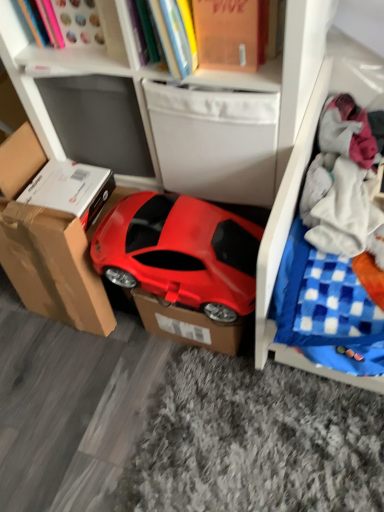
You are a GUI agent. You are given a task and a screenshot of the screen. Output one action in this format:
    pyautogui.click(x=<x>, y=<y>)
    Task: Click on the white matte drawer at center
    
    Given the screenshot: What is the action you would take?
    pyautogui.click(x=215, y=141)

What is the approximate width of brown cardboard box at left, arranged as the second cardboard box when viewed from the right?

It is 4.59 inches.

Identify the location of matte white bookcase at upper center. (171, 108).

Where is `orange matte book at upper center`? Image resolution: width=384 pixels, height=512 pixels. orange matte book at upper center is located at coordinates (222, 45).

At what (x,y) coordinates should I click in order to perform the action: click on white plastic cabinet at upper center. Please return your answer as a coordinate pair (x, y). The image size is (384, 512). Looking at the image, I should click on (51, 51).

From the image's perspective, which one is positioned lower, white soft fabric at right or matte cardboard box at center, the first cardboard box viewed from the right?

matte cardboard box at center, the first cardboard box viewed from the right, appears lower in the image.

Is white soft fabric at right far from matte cardboard box at center, the first cardboard box viewed from the right?

Actually, white soft fabric at right and matte cardboard box at center, the first cardboard box viewed from the right, are a little close together.

Which is more to the right, white soft fabric at right or matte cardboard box at center, the first cardboard box viewed from the right?

white soft fabric at right.

Between point (357, 135) and point (186, 311), which one is positioned in front?

Positioned in front is point (357, 135).

Looking at this image, is white matte drawer at center aimed at matte white bookcase at upper center?

Yes, white matte drawer at center is oriented towards matte white bookcase at upper center.

At what (x,y) coordinates should I click in order to perform the action: click on drawer above the matte white bookcase at upper center (from a real-world perspective). Please return your answer as a coordinate pair (x, y). This screenshot has height=512, width=384. Looking at the image, I should click on (215, 141).

From a real-world perspective, is white matte drawer at center positioned over matte white bookcase at upper center based on gravity?

Indeed, from a real-world perspective, white matte drawer at center stands above matte white bookcase at upper center.

Measure the distance between orange matte book at upper center and white soft fabric at right.

orange matte book at upper center and white soft fabric at right are 15.08 inches apart from each other.

Is orange matte book at upper center oriented away from white soft fabric at right?

No.

From the image's perspective, is orange matte book at upper center above or below white soft fabric at right?

Based on their image positions, orange matte book at upper center is located above white soft fabric at right.

From a real-world perspective, who is located lower, orange matte book at upper center or white soft fabric at right?

white soft fabric at right is physically lower.

Considering the sizes of objects white soft fabric at right and brown cardboard box at left, the first cardboard box positioned from the left, in the image provided, who is smaller, white soft fabric at right or brown cardboard box at left, the first cardboard box positioned from the left,?

white soft fabric at right is smaller.

Is white soft fabric at right facing towards brown cardboard box at left, the first cardboard box positioned from the left?

No, white soft fabric at right is not turned towards brown cardboard box at left, the first cardboard box positioned from the left.

From a real-world perspective, does white soft fabric at right sit lower than brown cardboard box at left, arranged as the second cardboard box when viewed from the right?

No, from a real-world perspective, white soft fabric at right is not below brown cardboard box at left, arranged as the second cardboard box when viewed from the right.

What are the coordinates of `clothing on the right side of brown cardboard box at left, the first cardboard box positioned from the left` in the screenshot? It's located at (345, 182).

Are white plastic cabinet at upper center and matte cardboard box at center, the first cardboard box viewed from the right, located far from each other?

No, white plastic cabinet at upper center is not far away from matte cardboard box at center, the first cardboard box viewed from the right.

From the image's perspective, does white plastic cabinet at upper center appear lower than matte cardboard box at center, the first cardboard box viewed from the right?

No, from the image's perspective, white plastic cabinet at upper center is not below matte cardboard box at center, the first cardboard box viewed from the right.

Is point (7, 11) closer or farther from the camera than point (203, 311)?

Point (7, 11) is positioned closer to the camera compared to point (203, 311).

In the scene shown: Is white plastic cabinet at upper center taller or shorter than matte cardboard box at center, the first cardboard box viewed from the right?

white plastic cabinet at upper center is shorter than matte cardboard box at center, the first cardboard box viewed from the right.

Between matte white bookcase at upper center and brown cardboard box at left, the first cardboard box positioned from the left, which one has larger size?

matte white bookcase at upper center.

From the image's perspective, starting from the matte white bookcase at upper center, which cardboard box is the 1st one below? Please provide its 2D coordinates.

[(52, 233)]

From a real-world perspective, is matte white bookcase at upper center physically located above or below brown cardboard box at left, the first cardboard box positioned from the left?

matte white bookcase at upper center is above brown cardboard box at left, the first cardboard box positioned from the left.

Between matte white bookcase at upper center and brown cardboard box at left, arranged as the second cardboard box when viewed from the right, which one has less height?

Standing shorter between the two is brown cardboard box at left, arranged as the second cardboard box when viewed from the right.

From the picture: Is white soft fabric at right smaller than orange matte book at upper center?

Indeed, white soft fabric at right has a smaller size compared to orange matte book at upper center.

From a real-world perspective, which object stands above the other?

In real-world perspective, orange matte book at upper center is above.

Who is more distant, white soft fabric at right or orange matte book at upper center?

white soft fabric at right is further from the camera.

In terms of width, does white soft fabric at right look wider or thinner when compared to orange matte book at upper center?

white soft fabric at right is thinner than orange matte book at upper center.

What are the coordinates of `the 2nd cardboard box positioned below the white soft fabric at right (from a real-world perspective)` in the screenshot? It's located at (188, 324).

Find the location of `bookcase lying in front of the white matte drawer at center`. bookcase lying in front of the white matte drawer at center is located at coordinates (171, 108).

Which object lies nearer to the anchor point matte plastic car at center, matte cardboard box at center, the second cardboard box from the left, or orange matte book at upper center?

matte cardboard box at center, the second cardboard box from the left, is positioned closer to the anchor matte plastic car at center.

When comparing their distances from orange matte book at upper center, does matte plastic car at center or brown cardboard box at left, arranged as the second cardboard box when viewed from the right, seem further?

brown cardboard box at left, arranged as the second cardboard box when viewed from the right, lies further to orange matte book at upper center than the other object.

When comparing their distances from white matte drawer at center, does matte cardboard box at center, the second cardboard box from the left, or matte plastic car at center seem further?

matte cardboard box at center, the second cardboard box from the left, is further to white matte drawer at center.

Which object lies further to the anchor point matte plastic car at center, white soft fabric at right or matte white bookcase at upper center?

white soft fabric at right.

From the picture: Looking at the image, which one is located further to white soft fabric at right, matte cardboard box at center, the first cardboard box viewed from the right, or orange matte book at upper center?

matte cardboard box at center, the first cardboard box viewed from the right.

When comparing their distances from matte cardboard box at center, the second cardboard box from the left, does matte plastic car at center or white soft fabric at right seem closer?

Among the two, matte plastic car at center is located nearer to matte cardboard box at center, the second cardboard box from the left.

Looking at the image, which one is located further to white soft fabric at right, orange matte book at upper center or brown cardboard box at left, arranged as the second cardboard box when viewed from the right?

Among the two, brown cardboard box at left, arranged as the second cardboard box when viewed from the right, is located further to white soft fabric at right.

Estimate the real-world distances between objects in this image. Which object is closer to matte cardboard box at center, the first cardboard box viewed from the right, white matte drawer at center or matte plastic car at center?

matte plastic car at center is closer to matte cardboard box at center, the first cardboard box viewed from the right.

Where is `car between white plastic cabinet at upper center and matte cardboard box at center, the second cardboard box from the left, from top to bottom`? This screenshot has height=512, width=384. car between white plastic cabinet at upper center and matte cardboard box at center, the second cardboard box from the left, from top to bottom is located at coordinates (179, 251).

Locate an element on the screen. This screenshot has height=512, width=384. bookcase that lies between orange matte book at upper center and matte plastic car at center from top to bottom is located at coordinates (171, 108).

You are a GUI agent. You are given a task and a screenshot of the screen. Output one action in this format:
    pyautogui.click(x=<x>, y=<y>)
    Task: Click on the car between orange matte book at upper center and brown cardboard box at left, arranged as the second cardboard box when viewed from the right, vertically
    This screenshot has height=512, width=384.
    Given the screenshot: What is the action you would take?
    pyautogui.click(x=179, y=251)

Image resolution: width=384 pixels, height=512 pixels. Find the location of `book between white plastic cabinet at upper center and white soft fabric at right in the horizontal direction`. book between white plastic cabinet at upper center and white soft fabric at right in the horizontal direction is located at coordinates (222, 45).